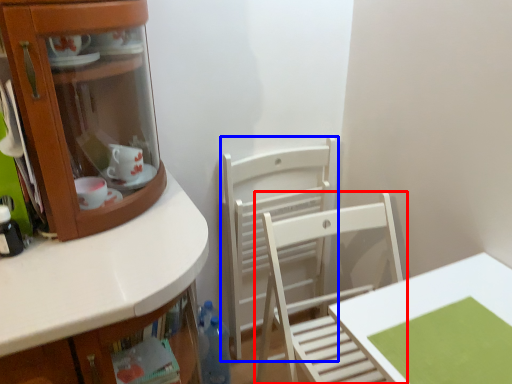
Question: Which object is closer to the camera taking this photo, chair (highlighted by a red box) or chair (highlighted by a blue box)?

Choices:
 (A) chair
 (B) chair

Answer: (A)